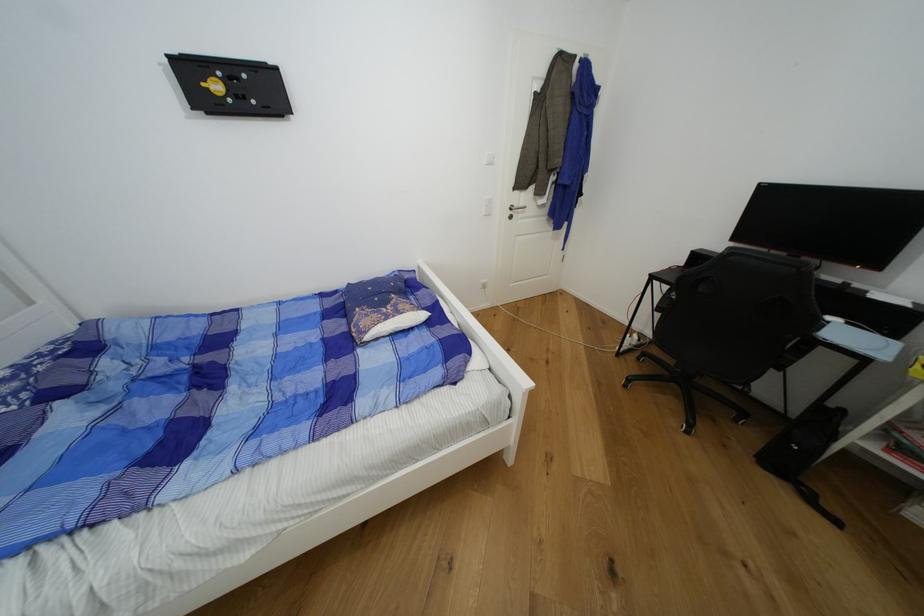
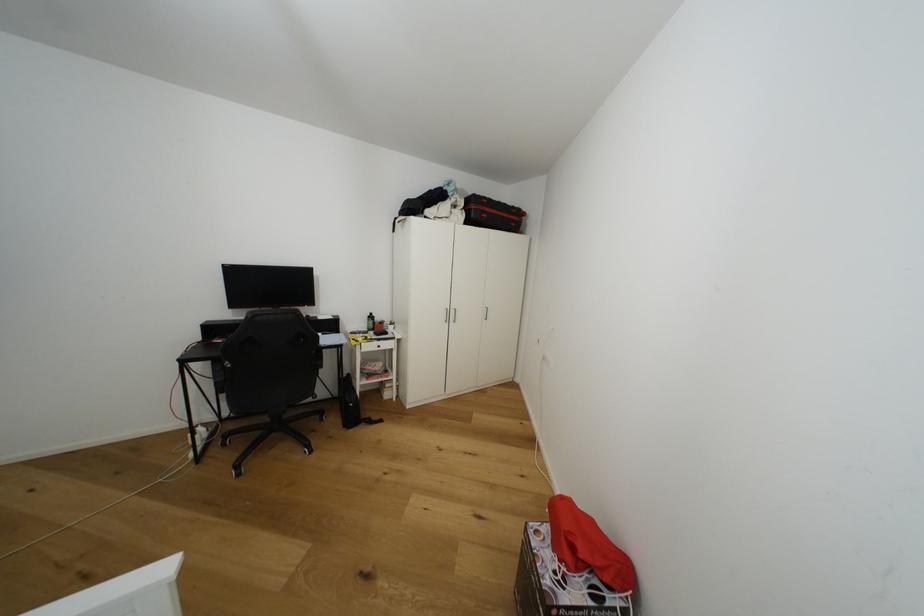
Question: The camera is either moving clockwise (left) or counter-clockwise (right) around the object. The first image is from the beginning of the video and the second image is from the end. Is the camera moving left or right when shooting the video?

Choices:
 (A) Left
 (B) Right

Answer: (A)